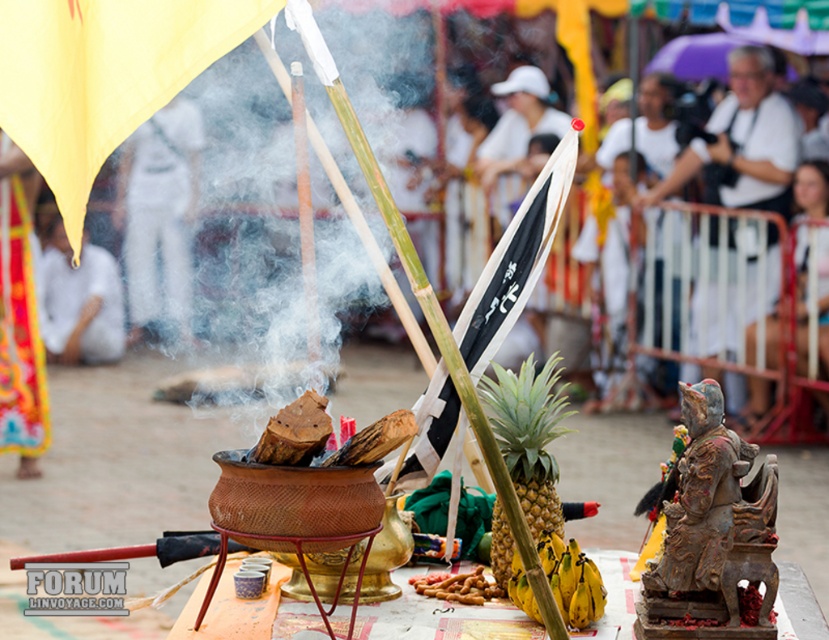
Question: Is bronze statue at right further to the viewer compared to yellow/green pineapple at center?

Choices:
 (A) yes
 (B) no

Answer: (A)

Question: Which point is farther from the camera taking this photo?

Choices:
 (A) (594, 570)
 (B) (162, 180)
 (C) (505, 442)

Answer: (B)

Question: Which object is closer to the camera taking this photo?

Choices:
 (A) yellow matte bananas at center
 (B) yellow/green pineapple at center

Answer: (B)

Question: Which point is closer to the camera taking this photo?

Choices:
 (A) (711, 412)
 (B) (532, 394)
 (C) (76, 305)
 (D) (161, 221)

Answer: (A)

Question: Does yellow/green pineapple at center appear on the left side of white cotton shirt at lower left?

Choices:
 (A) yes
 (B) no

Answer: (B)

Question: Is white cotton shirt at upper center positioned at the back of yellow/green pineapple at center?

Choices:
 (A) no
 (B) yes

Answer: (B)